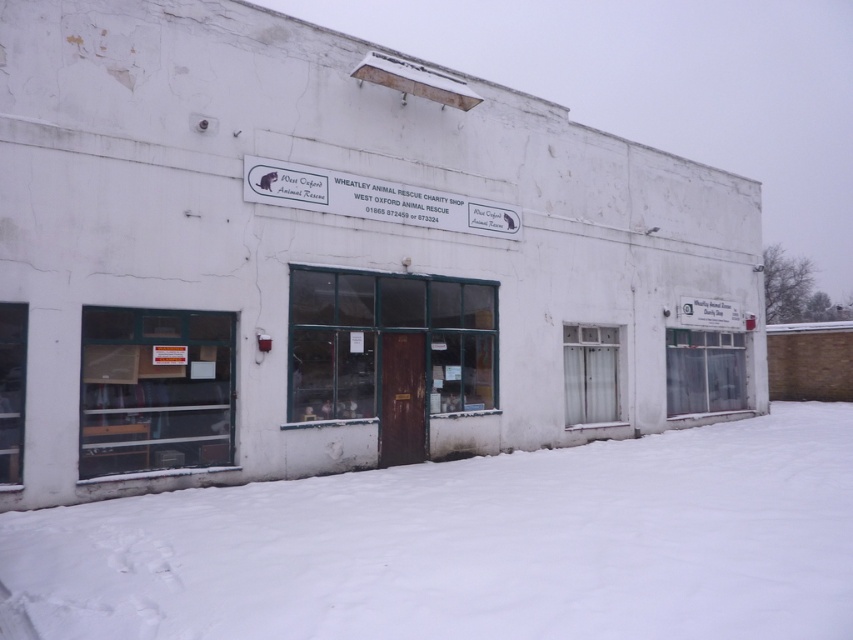
Does white powdery snow at lower center have a lesser width compared to clear glass shelves at lower left?

In fact, white powdery snow at lower center might be wider than clear glass shelves at lower left.

Is white powdery snow at lower center smaller than clear glass shelves at lower left?

No.

Which is in front, point (393, 580) or point (204, 440)?

Point (393, 580) is more forward.

You are a GUI agent. You are given a task and a screenshot of the screen. Output one action in this format:
    pyautogui.click(x=<x>, y=<y>)
    Task: Click on the white powdery snow at lower center
    This screenshot has height=640, width=853.
    Given the screenshot: What is the action you would take?
    pyautogui.click(x=474, y=545)

Can you confirm if white powdery snow at lower center is positioned above white plastic sign at upper center?

No, white powdery snow at lower center is not above white plastic sign at upper center.

Where is `white powdery snow at lower center`? This screenshot has width=853, height=640. white powdery snow at lower center is located at coordinates (474, 545).

Where is `white powdery snow at lower center`? white powdery snow at lower center is located at coordinates (474, 545).

Who is more distant from viewer, (167, 401) or (286, 166)?

Positioned behind is point (286, 166).

Who is taller, clear glass shelves at lower left or white plastic sign at upper center?

clear glass shelves at lower left

At what (x,y) coordinates should I click in order to perform the action: click on clear glass shelves at lower left. Please return your answer as a coordinate pair (x, y). This screenshot has width=853, height=640. Looking at the image, I should click on (155, 388).